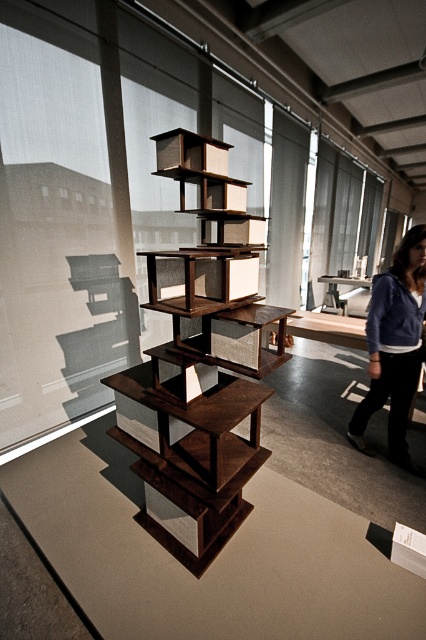
Looking at this image, you are standing in the exhibition space and want to take a photo of the point at coordinates (x=186, y=440). If your camera has a focal length of 50mm and you are currently 2.37 meters away from the point, will you need to move closer or farther to ensure the point fills the frame properly?

The point at coordinates (x=186, y=440) is already 2.37 meters from the camera. To fill the frame properly, you would need to adjust your distance based on the camera sensor size and desired framing, but since the current distance is already set, no movement is required unless further adjustment is needed. However, without specific sensor dimensions, it is difficult to determine exact movement requirements.

You are standing at the entrance of the exhibition space and want to locate the dark brown wood bookshelf at center. According to the coordinates provided, where should you look to find it?

The dark brown wood bookshelf at center is located at coordinates point (201, 365), so you should look towards the central area of the exhibition space to find it.

In the scene shown: You are an architect visiting the exhibition and notice the dark brown wood bookshelf at center and the blue fleece jacket at lower right. Which object is closer to the viewer?

The dark brown wood bookshelf at center is positioned over the blue fleece jacket at lower right, meaning it is closer to the viewer.